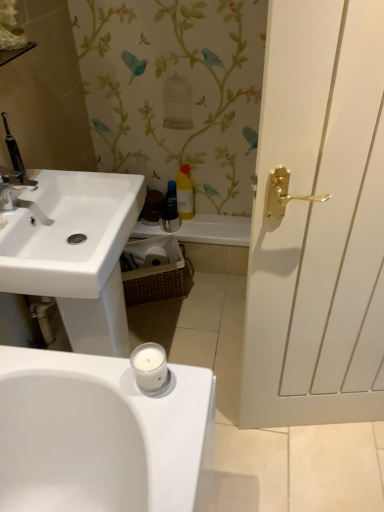
You are a GUI agent. You are given a task and a screenshot of the screen. Output one action in this format:
    pyautogui.click(x=<x>, y=<y>)
    Task: Click on the vacant space in front of yellow matte bottle at center, the first toiletry in the right-to-left sequence
    
    Given the screenshot: What is the action you would take?
    pyautogui.click(x=200, y=228)